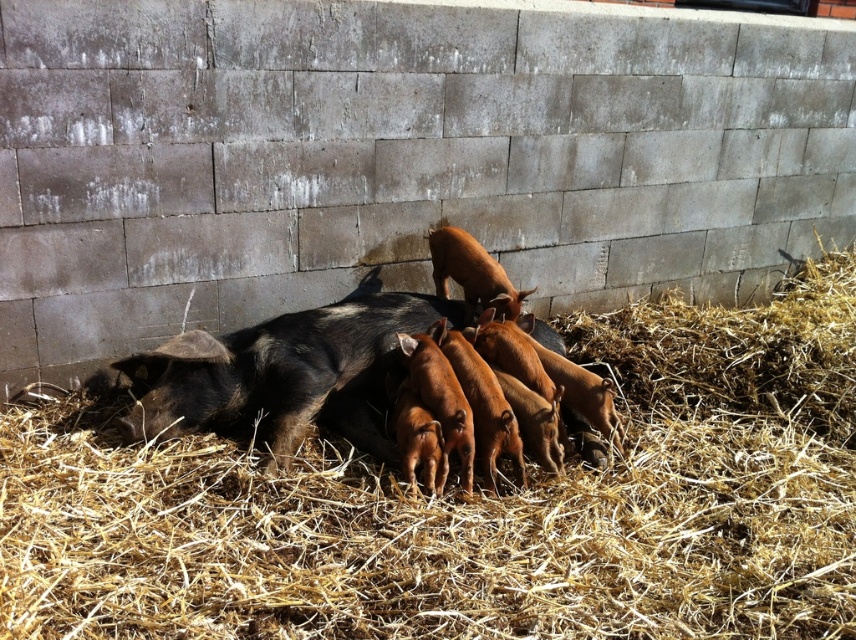
You are standing in front of the piglets and their mother in the barn. You notice two points marked on the ground. One is at coordinate point (266, 323) and the other at point (236, 374). If you want to place a food bowl closer to the mother pig, which point should you choose?

Point (236, 374) is closer to the mother pig because point (266, 323) is behind it, meaning the mother is nearer to point (236, 374).